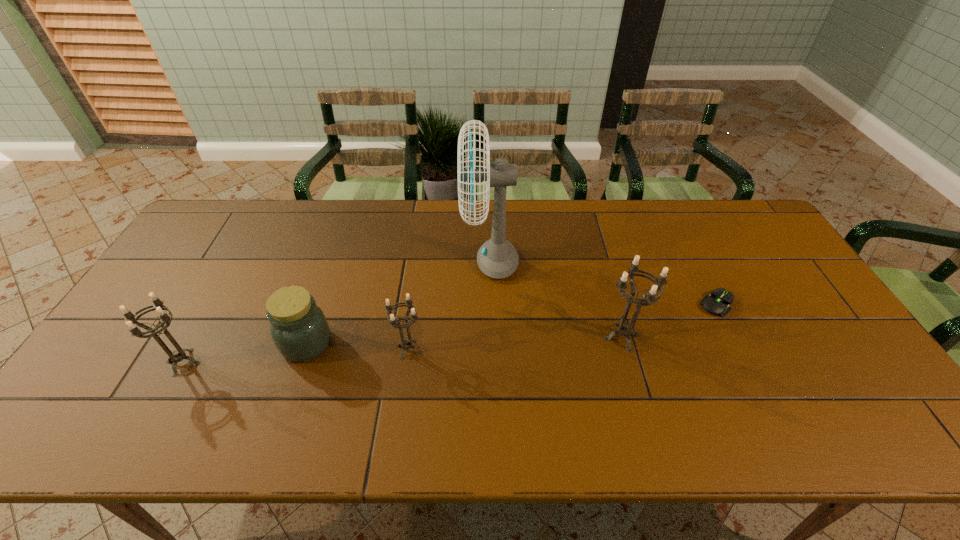
Locate an element on the screen. This screenshot has height=540, width=960. object at the left edge is located at coordinates (x=178, y=355).

The height and width of the screenshot is (540, 960). What are the coordinates of `object that is at the near left corner` in the screenshot? It's located at (178, 355).

Find the location of `blank area at the far edge`. blank area at the far edge is located at coordinates 354,201.

In the image, there is a desktop. Identify the location of vacant space at the near edge. The height and width of the screenshot is (540, 960). (720, 402).

The height and width of the screenshot is (540, 960). Find the location of `vacant space at the left edge of the desktop`. vacant space at the left edge of the desktop is located at coordinates (128, 355).

At what (x,y) coordinates should I click in order to perform the action: click on vacant region at the right edge of the desktop. Please return your answer as a coordinate pair (x, y). This screenshot has width=960, height=540. Looking at the image, I should click on tap(811, 301).

Locate an element on the screen. This screenshot has height=540, width=960. free space at the far left corner of the desktop is located at coordinates (x=241, y=219).

Image resolution: width=960 pixels, height=540 pixels. In the image, there is a desktop. Identify the location of vacant area at the near left corner. (84, 387).

Where is `blank space at the far right corner`? The height and width of the screenshot is (540, 960). blank space at the far right corner is located at coordinates (722, 211).

Identify the location of vacant point located between the second object from left to right and the shortest object. (512, 324).